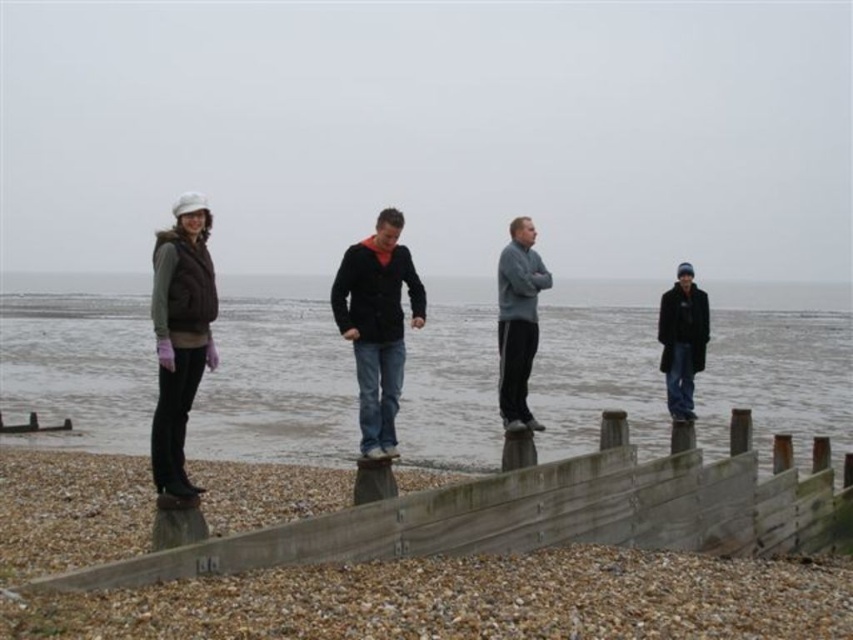
Question: Which of the following is the farthest from the observer?

Choices:
 (A) gray fleece jacket at center
 (B) dark blue jeans at center
 (C) dark blue woolen coat at right
 (D) gray water at center

Answer: (C)

Question: Does gray water at center lie behind matte brown vest at left?

Choices:
 (A) yes
 (B) no

Answer: (A)

Question: Is gray water at center positioned at the back of dark blue woolen coat at right?

Choices:
 (A) no
 (B) yes

Answer: (A)

Question: Which point is farther to the camera?

Choices:
 (A) (670, 403)
 (B) (196, 272)

Answer: (A)

Question: Estimate the real-world distances between objects in this image. Which object is closer to the gray fleece jacket at center?

Choices:
 (A) dark blue woolen coat at right
 (B) matte brown vest at left

Answer: (A)

Question: From the image, what is the correct spatial relationship of gray water at center in relation to dark blue jeans at center?

Choices:
 (A) above
 (B) below

Answer: (A)